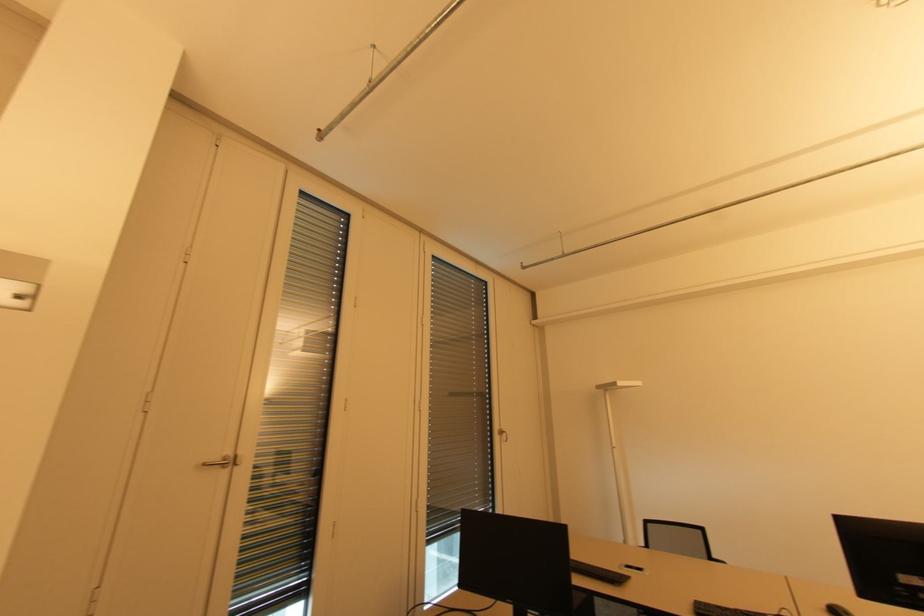
Find where to press the white light switch. Please return your answer as a coordinate pair (x, y).

(18, 294)